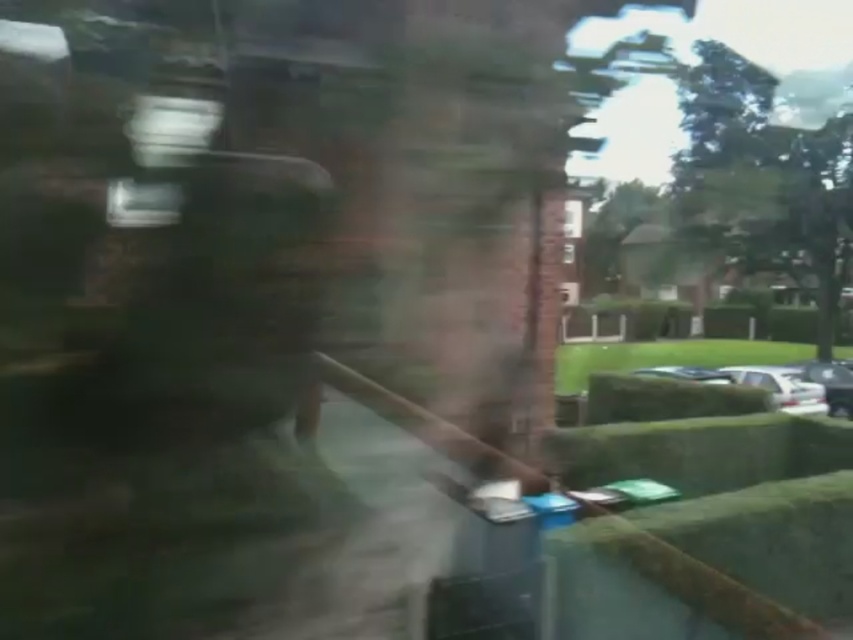
Can you confirm if white glossy car at lower right is positioned to the right of shiny silver car at center?

Correct, you'll find white glossy car at lower right to the right of shiny silver car at center.

Between point (776, 406) and point (672, 374), which one is positioned in front?

Point (776, 406)

Locate an element on the screen. white glossy car at lower right is located at coordinates (782, 387).

Between white glossy car at lower right and shiny silver car at lower right, which one is positioned lower?

Positioned lower is shiny silver car at lower right.

At what (x,y) coordinates should I click in order to perform the action: click on white glossy car at lower right. Please return your answer as a coordinate pair (x, y). The image size is (853, 640). Looking at the image, I should click on (782, 387).

Where is `white glossy car at lower right`? white glossy car at lower right is located at coordinates (782, 387).

Is point (842, 364) closer to viewer compared to point (677, 369)?

That is False.

Locate an element on the screen. shiny silver car at lower right is located at coordinates (833, 385).